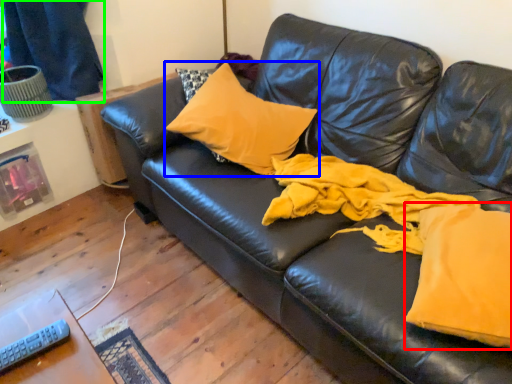
Question: Considering the real-world distances, which object is farthest from fabric (highlighted by a red box)? pillow (highlighted by a blue box) or curtain (highlighted by a green box)?

Choices:
 (A) pillow
 (B) curtain

Answer: (B)